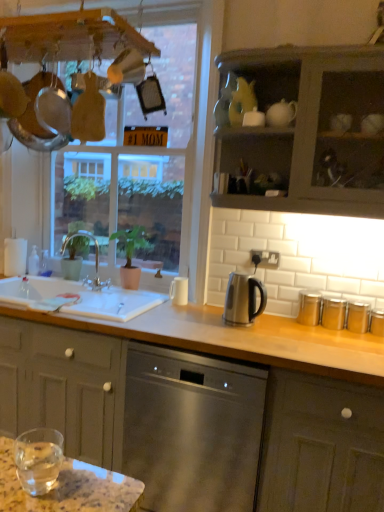
Locate an element on the screen. This screenshot has height=512, width=384. free space that is to the left of brushed metal faucet at sink left is located at coordinates (60, 285).